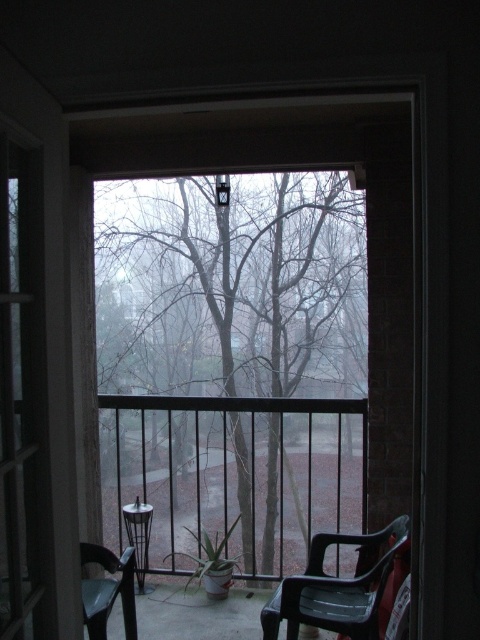
From the picture: Who is lower down, transparent plastic screen door at left or translucent plastic chair at lower right?

translucent plastic chair at lower right is below.

Is transparent plastic screen door at left wider than translucent plastic chair at lower right?

No.

Between point (0, 305) and point (338, 541), which one is positioned behind?

Point (338, 541)

You are a GUI agent. You are given a task and a screenshot of the screen. Output one action in this format:
    pyautogui.click(x=<x>, y=<y>)
    Task: Click on the transparent plastic screen door at left
    
    Given the screenshot: What is the action you would take?
    pyautogui.click(x=21, y=392)

Between bare branches at center and black metal railing at center, which one appears on the left side from the viewer's perspective?

bare branches at center

Between bare branches at center and black metal railing at center, which one is positioned higher?

black metal railing at center is higher up.

Find the location of a particular element. This screenshot has height=640, width=480. bare branches at center is located at coordinates (232, 362).

Locate an element on the screen. This screenshot has width=480, height=640. bare branches at center is located at coordinates (232, 362).

Is the position of black metal railing at center more distant than that of translucent plastic chair at lower right?

Yes, it is behind translucent plastic chair at lower right.

Does black metal railing at center appear under translucent plastic chair at lower right?

Yes, black metal railing at center is below translucent plastic chair at lower right.

Is point (319, 522) positioned behind point (407, 525)?

Yes, point (319, 522) is behind point (407, 525).

What are the coordinates of `black metal railing at center` in the screenshot? It's located at (233, 474).